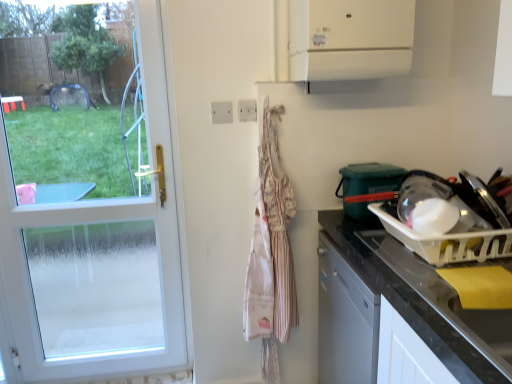
The image size is (512, 384). I want to click on striped fabric apron at center, so click(x=271, y=253).

Describe the element at coordinates (222, 112) in the screenshot. The image size is (512, 384). I see `white plastic electric outlet at upper center, the first electric outlet viewed from the left` at that location.

Locate an element on the screen. The width and height of the screenshot is (512, 384). white glass door at left is located at coordinates (100, 261).

The height and width of the screenshot is (384, 512). Describe the element at coordinates (409, 302) in the screenshot. I see `black granite countertop at right` at that location.

Find the location of a particular element. This screenshot has height=384, width=512. white plastic electric outlet at upper center, marked as the second electric outlet in a left-to-right arrangement is located at coordinates (247, 110).

Considering the points (280, 167) and (225, 115), which point is in front, point (280, 167) or point (225, 115)?

The point (280, 167) is in front.

From the image's perspective, which one is positioned higher, striped fabric apron at center or white plastic electric outlet at upper center, the 2th electric outlet from the right?

From the image's view, white plastic electric outlet at upper center, the 2th electric outlet from the right, is above.

Between striped fabric apron at center and white plastic electric outlet at upper center, the first electric outlet viewed from the left, which one has larger width?

With larger width is striped fabric apron at center.

Can you confirm if white plastic electric outlet at upper center, positioned as the 1th electric outlet in right-to-left order, is thinner than white glass door at left?

Correct, the width of white plastic electric outlet at upper center, positioned as the 1th electric outlet in right-to-left order, is less than that of white glass door at left.

Find the location of a particular element. The height and width of the screenshot is (384, 512). door located on the left of white plastic electric outlet at upper center, marked as the second electric outlet in a left-to-right arrangement is located at coordinates (100, 261).

Considering the relative sizes of white plastic electric outlet at upper center, positioned as the 1th electric outlet in right-to-left order, and white glass door at left in the image provided, is white plastic electric outlet at upper center, positioned as the 1th electric outlet in right-to-left order, taller than white glass door at left?

In fact, white plastic electric outlet at upper center, positioned as the 1th electric outlet in right-to-left order, may be shorter than white glass door at left.

From a real-world perspective, between white plastic vent at upper center and transparent plastic bowl at right, the first appliance positioned from the top, who is vertically lower?

transparent plastic bowl at right, the first appliance positioned from the top, is physically lower.

Which of these two, white plastic vent at upper center or transparent plastic bowl at right, the first appliance positioned from the top, stands taller?

Standing taller between the two is white plastic vent at upper center.

Is the depth of white plastic vent at upper center less than that of transparent plastic bowl at right, the first appliance positioned from the top?

No, it is behind transparent plastic bowl at right, the first appliance positioned from the top.

At what (x,y) coordinates should I click in order to perform the action: click on vent that appears behind the transparent plastic bowl at right, which is counted as the second appliance, starting from the bottom. Please return your answer as a coordinate pair (x, y). The width and height of the screenshot is (512, 384). Looking at the image, I should click on (350, 39).

Is white plastic vent at upper center smaller than white plastic dish rack at right, the first appliance when ordered from bottom to top?

Incorrect, white plastic vent at upper center is not smaller in size than white plastic dish rack at right, the first appliance when ordered from bottom to top.

Is white plastic vent at upper center aimed at white plastic dish rack at right, the first appliance when ordered from bottom to top?

No, white plastic vent at upper center is not aimed at white plastic dish rack at right, the first appliance when ordered from bottom to top.

In the scene shown: Can you confirm if white plastic vent at upper center is positioned to the left of white plastic dish rack at right, which ranks as the 2th appliance in top-to-bottom order?

Indeed, white plastic vent at upper center is positioned on the left side of white plastic dish rack at right, which ranks as the 2th appliance in top-to-bottom order.

In the scene shown: Which is more distant, (327,69) or (476,238)?

Point (327,69)

Find the location of a particular element. This screenshot has width=512, height=384. countertop in front of the transparent plastic bowl at right, the first appliance positioned from the top is located at coordinates (409, 302).

Is black granite countertop at right facing towards transparent plastic bowl at right, which is counted as the second appliance, starting from the bottom?

No, black granite countertop at right is not turned towards transparent plastic bowl at right, which is counted as the second appliance, starting from the bottom.

Is point (472, 369) behind point (367, 171)?

That is False.

Which of these two, black granite countertop at right or transparent plastic bowl at right, which is counted as the second appliance, starting from the bottom, is thinner?

transparent plastic bowl at right, which is counted as the second appliance, starting from the bottom.

Does striped fabric apron at center appear on the left side of white glass door at left?

No, striped fabric apron at center is not to the left of white glass door at left.

Is striped fabric apron at center taller or shorter than white glass door at left?

In the image, striped fabric apron at center appears to be shorter than white glass door at left.

From a real-world perspective, is striped fabric apron at center positioned above or below white glass door at left?

striped fabric apron at center is below white glass door at left.

How many degrees apart are the facing directions of striped fabric apron at center and white glass door at left?

0.00262 degrees separate the facing orientations of striped fabric apron at center and white glass door at left.

From a real-world perspective, is white plastic electric outlet at upper center, the first electric outlet viewed from the left, below black granite countertop at right?

Actually, white plastic electric outlet at upper center, the first electric outlet viewed from the left, is physically above black granite countertop at right in the real world.

Between white plastic electric outlet at upper center, the first electric outlet viewed from the left, and black granite countertop at right, which one is positioned in front?

black granite countertop at right is in front.

Are white plastic electric outlet at upper center, the 2th electric outlet from the right, and black granite countertop at right far apart?

Actually, white plastic electric outlet at upper center, the 2th electric outlet from the right, and black granite countertop at right are a little close together.

The width and height of the screenshot is (512, 384). What are the coordinates of `the 1st electric outlet above the striped fabric apron at center (from a real-world perspective)` in the screenshot? It's located at (222, 112).

Locate an element on the screen. Image resolution: width=512 pixels, height=384 pixels. door located in front of the white plastic electric outlet at upper center, positioned as the 1th electric outlet in right-to-left order is located at coordinates (100, 261).

From the image, which object appears to be farther from black granite countertop at right, white glass door at left or white plastic electric outlet at upper center, marked as the second electric outlet in a left-to-right arrangement?

Based on the image, white glass door at left appears to be further to black granite countertop at right.

Estimate the real-world distances between objects in this image. Which object is closer to white plastic electric outlet at upper center, the 2th electric outlet from the right, striped fabric apron at center or white plastic dish rack at right, the first appliance when ordered from bottom to top?

Based on the image, striped fabric apron at center appears to be nearer to white plastic electric outlet at upper center, the 2th electric outlet from the right.

Based on their spatial positions, is white plastic electric outlet at upper center, marked as the second electric outlet in a left-to-right arrangement, or black granite countertop at right closer to white plastic vent at upper center?

white plastic electric outlet at upper center, marked as the second electric outlet in a left-to-right arrangement, lies closer to white plastic vent at upper center than the other object.

Based on their spatial positions, is white plastic dish rack at right, which ranks as the 2th appliance in top-to-bottom order, or transparent plastic bowl at right, the first appliance positioned from the top, further from white plastic electric outlet at upper center, the 2th electric outlet from the right?

white plastic dish rack at right, which ranks as the 2th appliance in top-to-bottom order, lies further to white plastic electric outlet at upper center, the 2th electric outlet from the right, than the other object.

Estimate the real-world distances between objects in this image. Which object is closer to white plastic electric outlet at upper center, the first electric outlet viewed from the left, white glass door at left or striped fabric apron at center?

Based on the image, striped fabric apron at center appears to be nearer to white plastic electric outlet at upper center, the first electric outlet viewed from the left.

Based on their spatial positions, is white plastic vent at upper center or transparent plastic bowl at right, which is counted as the second appliance, starting from the bottom, closer to black granite countertop at right?

transparent plastic bowl at right, which is counted as the second appliance, starting from the bottom, is closer to black granite countertop at right.

Looking at the image, which one is located further to white plastic electric outlet at upper center, positioned as the 1th electric outlet in right-to-left order, black granite countertop at right or white plastic vent at upper center?

black granite countertop at right lies further to white plastic electric outlet at upper center, positioned as the 1th electric outlet in right-to-left order, than the other object.

Considering their positions, is white plastic electric outlet at upper center, the first electric outlet viewed from the left, positioned closer to white plastic dish rack at right, which ranks as the 2th appliance in top-to-bottom order, than white plastic vent at upper center?

Based on the image, white plastic vent at upper center appears to be nearer to white plastic dish rack at right, which ranks as the 2th appliance in top-to-bottom order.

At what (x,y) coordinates should I click in order to perform the action: click on clothesline between white glass door at left and white plastic dish rack at right, the first appliance when ordered from bottom to top, in the horizontal direction. Please return your answer as a coordinate pair (x, y). This screenshot has width=512, height=384. Looking at the image, I should click on coord(271,253).

Where is `clothesline situated between white plastic electric outlet at upper center, positioned as the 1th electric outlet in right-to-left order, and white plastic dish rack at right, which ranks as the 2th appliance in top-to-bottom order, from left to right`? clothesline situated between white plastic electric outlet at upper center, positioned as the 1th electric outlet in right-to-left order, and white plastic dish rack at right, which ranks as the 2th appliance in top-to-bottom order, from left to right is located at coordinates (271, 253).

I want to click on electric outlet between white plastic electric outlet at upper center, marked as the second electric outlet in a left-to-right arrangement, and striped fabric apron at center in the up-down direction, so click(222, 112).

Locate an element on the screen. clothesline between white glass door at left and white plastic vent at upper center in the horizontal direction is located at coordinates (271, 253).